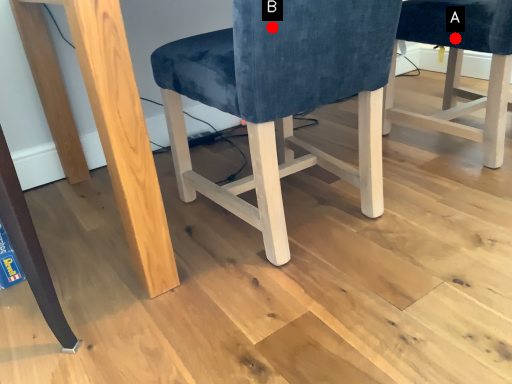
Question: Two points are circled on the image, labeled by A and B beside each circle. Which point is closer to the camera?

Choices:
 (A) A is closer
 (B) B is closer

Answer: (B)